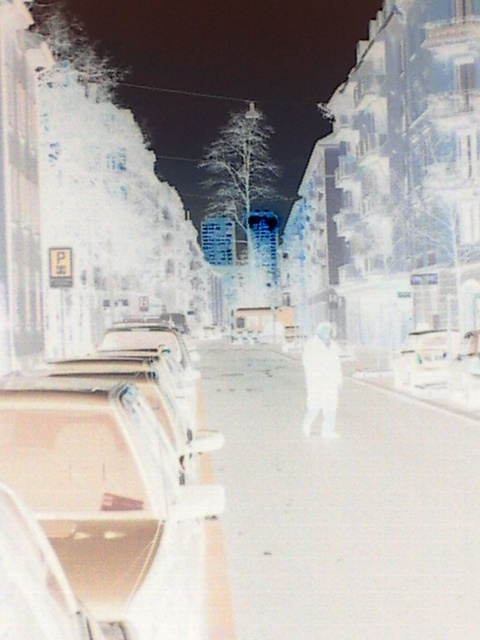
Question: Where is white smooth pavement at center located in relation to white matte man at center in the image?

Choices:
 (A) right
 (B) left

Answer: (B)

Question: Which of the following is the closest to the observer?

Choices:
 (A) (236, 593)
 (B) (408, 372)

Answer: (A)

Question: Which is nearer to the white matte man at center?

Choices:
 (A) white glossy car at center
 (B) white smooth pavement at center
 (C) metallic gold car at left

Answer: (B)

Question: Can you confirm if white matte man at center is positioned to the right of white glossy car at center?

Choices:
 (A) no
 (B) yes

Answer: (A)

Question: Can you confirm if metallic gold car at left is bigger than white glossy car at center?

Choices:
 (A) yes
 (B) no

Answer: (B)

Question: Which point is closer to the camera?

Choices:
 (A) (84, 369)
 (B) (415, 385)
 (C) (302, 348)

Answer: (A)